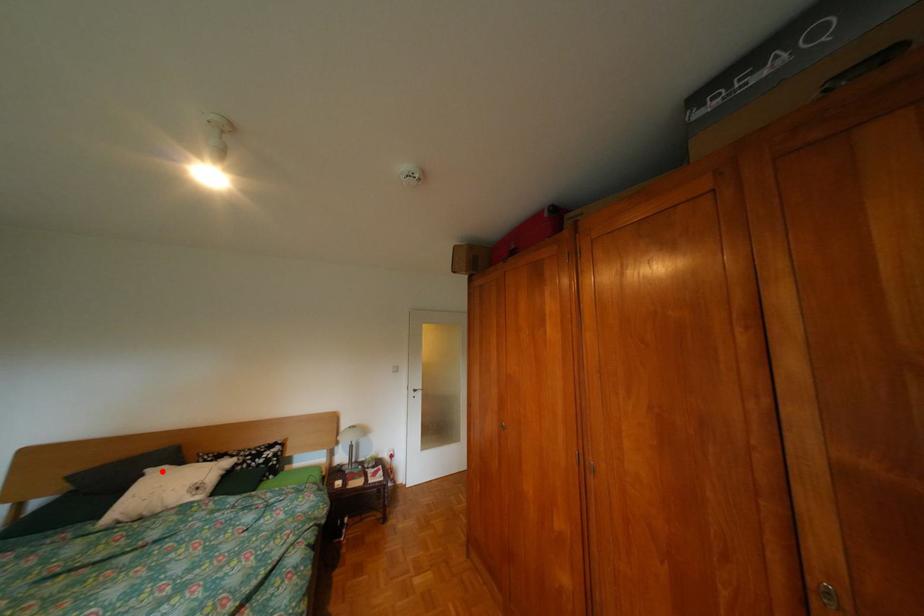
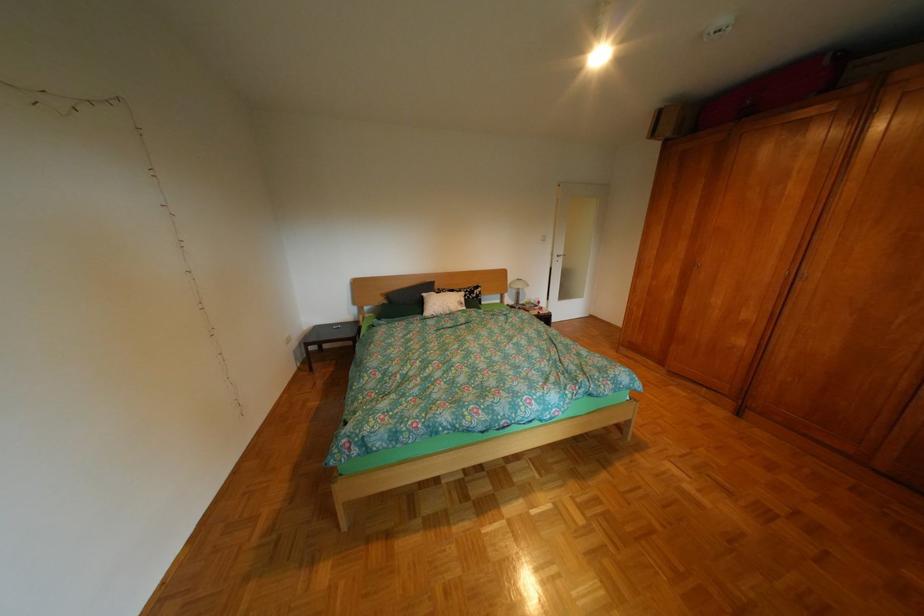
In the second image, find the point that corresponds to the highlighted location in the first image.

(439, 294)